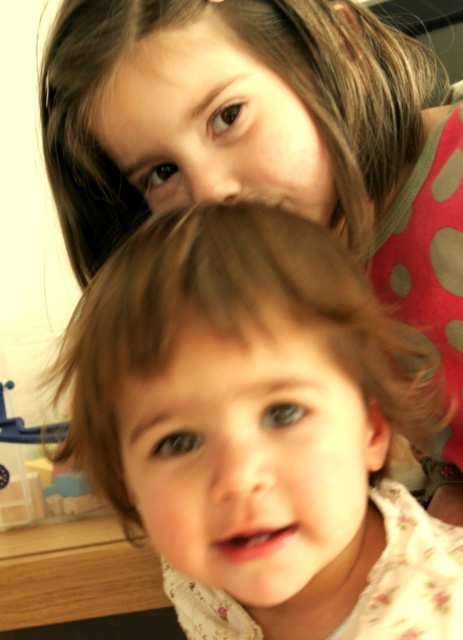
Question: Which of the following is the closest to the observer?

Choices:
 (A) (75, 150)
 (B) (267, 532)

Answer: (B)

Question: Which point is farther to the camera?

Choices:
 (A) (83, 115)
 (B) (367, 385)

Answer: (A)

Question: Does fluffy brown hair at center come behind brown smooth hair at upper center?

Choices:
 (A) yes
 (B) no

Answer: (B)

Question: Observing the image, what is the correct spatial positioning of fluffy brown hair at center in reference to brown smooth hair at upper center?

Choices:
 (A) below
 (B) above

Answer: (A)

Question: Which object is farther from the camera taking this photo?

Choices:
 (A) brown smooth hair at upper center
 (B) fluffy brown hair at center

Answer: (A)

Question: Is fluffy brown hair at center behind brown smooth hair at upper center?

Choices:
 (A) yes
 (B) no

Answer: (B)